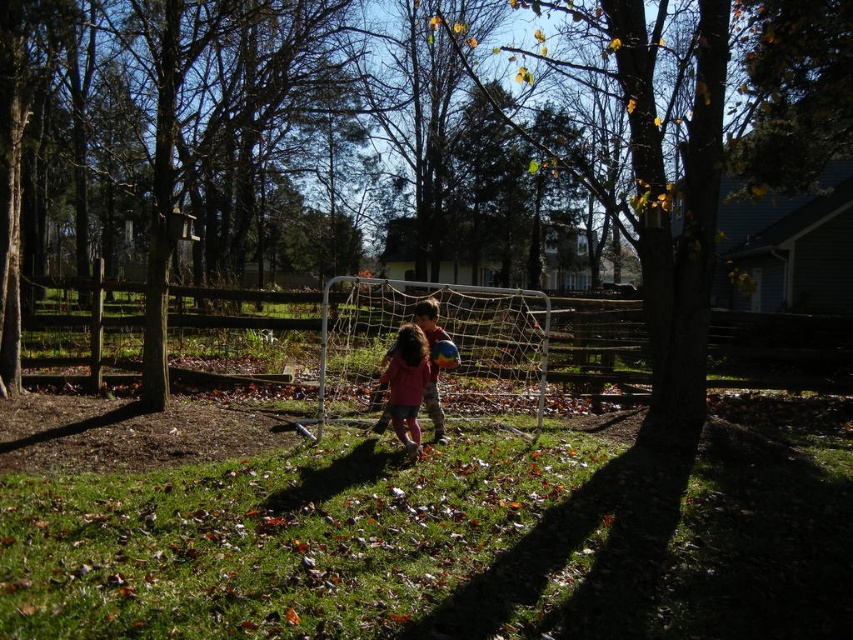
Question: Which point appears farthest from the camera in this image?

Choices:
 (A) (407, 355)
 (B) (555, 358)

Answer: (B)

Question: Which of the following is the closest to the observer?

Choices:
 (A) matte pink dress at center
 (B) wooden fence at center

Answer: (B)

Question: Which of the following is the farthest from the observer?

Choices:
 (A) (552, 339)
 (B) (401, 360)

Answer: (A)

Question: Can you confirm if wooden fence at center is positioned above matte pink dress at center?

Choices:
 (A) yes
 (B) no

Answer: (A)

Question: From the image, what is the correct spatial relationship of wooden fence at center in relation to matte pink dress at center?

Choices:
 (A) right
 (B) left

Answer: (B)

Question: Is wooden fence at center bigger than matte pink dress at center?

Choices:
 (A) yes
 (B) no

Answer: (A)